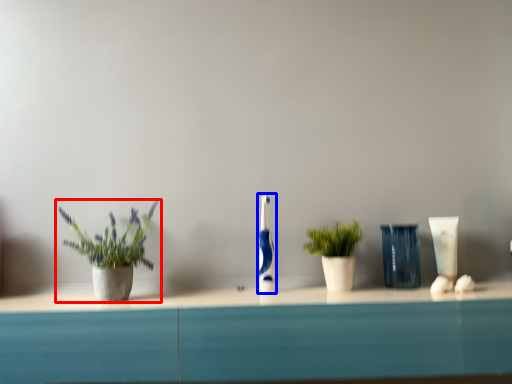
Question: Which object appears farthest to the camera in this image, houseplant (highlighted by a red box) or toothbrush (highlighted by a blue box)?

Choices:
 (A) houseplant
 (B) toothbrush

Answer: (B)